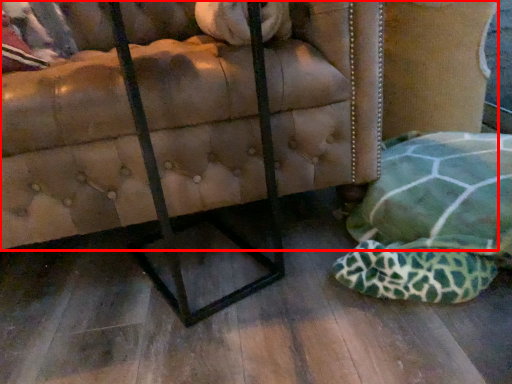
Question: Where is furniture (annotated by the red box) located in relation to swivel chair in the image?

Choices:
 (A) right
 (B) left

Answer: (B)